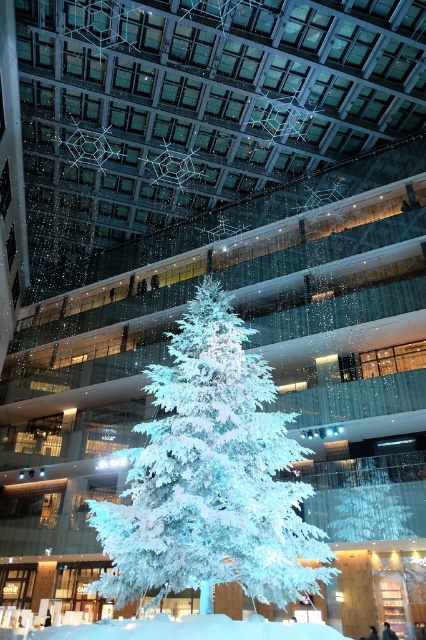
Question: Can you confirm if white frosty tree at center is thinner than white frosty snow at center?

Choices:
 (A) no
 (B) yes

Answer: (A)

Question: Which of the following is the closest to the observer?

Choices:
 (A) white frosty snow at center
 (B) white frosty tree at center

Answer: (A)

Question: Can you confirm if white frosty tree at center is positioned above white frosty snow at center?

Choices:
 (A) yes
 (B) no

Answer: (A)

Question: Can you confirm if white frosty tree at center is wider than white frosty snow at center?

Choices:
 (A) yes
 (B) no

Answer: (A)